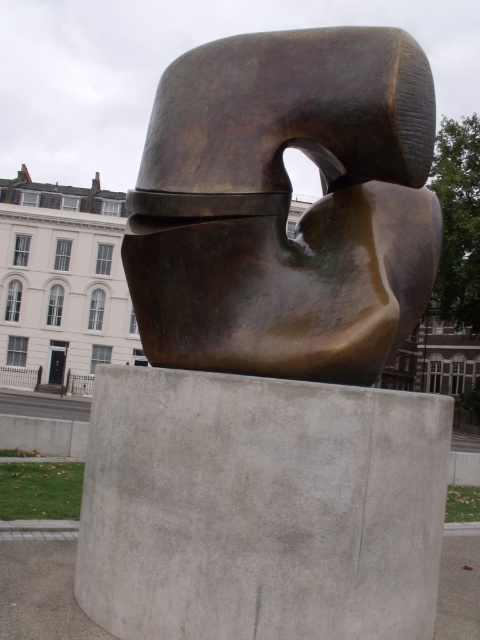
What are the coordinates of the bronze sculpture at center in the image?

The bronze sculpture at center is located at coordinates point (x=286, y=205).

You are an art student trying to sketch the sculpture and its pedestal. You notice that the bronze sculpture at center and the gray concrete at center have different widths. Which one should you draw as narrower in your sketch?

The bronze sculpture at center is thinner than the gray concrete at center, so you should draw the bronze sculpture at center as narrower.

You are standing in front of the sculpture and looking at it. There are two points on the sculpture labeled as point (x=276, y=243) and point (x=433, y=616). Which point is nearer to your eyes?

Point (x=276, y=243) is closer to the camera than point (x=433, y=616), so the point (x=276, y=243) is nearer to your eyes.